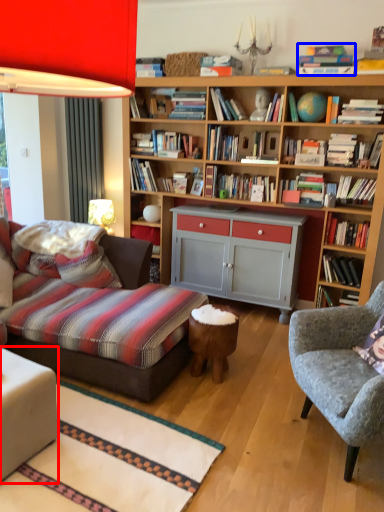
Question: Which of the following is the closest to the observer, table (highlighted by a red box) or book (highlighted by a blue box)?

Choices:
 (A) table
 (B) book

Answer: (A)